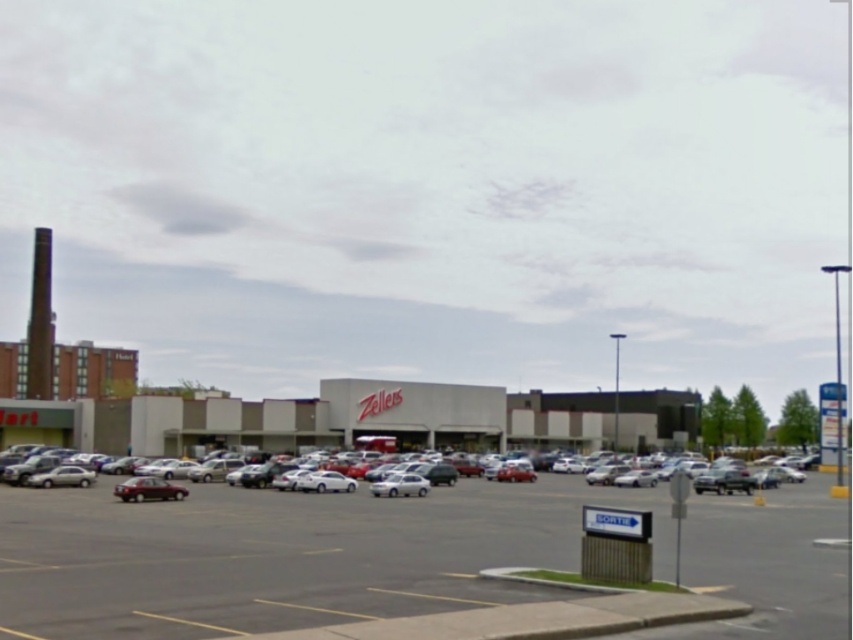
Can you confirm if shiny silver sedan at center is thinner than white glossy sedan at center?

No, shiny silver sedan at center is not thinner than white glossy sedan at center.

Is point (86, 458) positioned before point (412, 484)?

No, it is not.

This screenshot has width=853, height=640. I want to click on shiny silver sedan at center, so click(x=119, y=465).

Does metallic silver cars at center appear on the left side of white glossy sedan at center?

Incorrect, metallic silver cars at center is not on the left side of white glossy sedan at center.

Describe the element at coordinates (285, 554) in the screenshot. I see `metallic silver cars at center` at that location.

Is point (148, 528) behind point (399, 492)?

No, it is in front of (399, 492).

You are a GUI agent. You are given a task and a screenshot of the screen. Output one action in this format:
    pyautogui.click(x=<x>, y=<y>)
    Task: Click on the metallic silver cars at center
    The width and height of the screenshot is (853, 640).
    Given the screenshot: What is the action you would take?
    pyautogui.click(x=285, y=554)

Between metallic silver cars at center and shiny silver sedan at center, which one appears on the left side from the viewer's perspective?

From the viewer's perspective, metallic silver cars at center appears more on the left side.

Is point (90, 596) farther from camera compared to point (41, 448)?

No.

Who is more distant from viewer, (x=752, y=522) or (x=122, y=460)?

Point (x=122, y=460)

At what (x,y) coordinates should I click in order to perform the action: click on metallic silver cars at center. Please return your answer as a coordinate pair (x, y). This screenshot has width=853, height=640. Looking at the image, I should click on (285, 554).